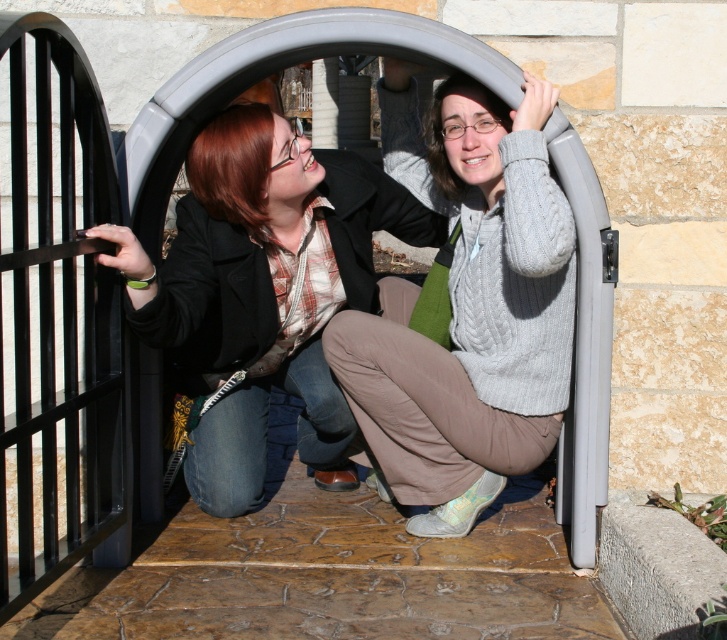
Question: Which object appears closest to the camera in this image?

Choices:
 (A) matte black coat at center
 (B) cable-knit sweater at center

Answer: (A)

Question: Which point is farther to the camera?

Choices:
 (A) cable-knit sweater at center
 (B) matte black coat at center

Answer: (A)

Question: Can you confirm if cable-knit sweater at center is smaller than matte black coat at center?

Choices:
 (A) no
 (B) yes

Answer: (B)

Question: Does cable-knit sweater at center lie in front of matte black coat at center?

Choices:
 (A) yes
 (B) no

Answer: (B)

Question: Which point is farther to the camera?

Choices:
 (A) cable-knit sweater at center
 (B) matte black coat at center

Answer: (A)

Question: Is the position of cable-knit sweater at center less distant than that of matte black coat at center?

Choices:
 (A) no
 (B) yes

Answer: (A)